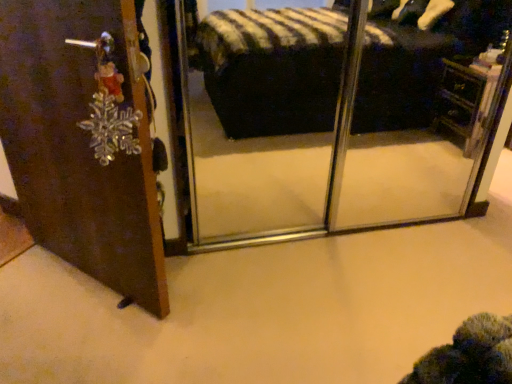
Where is `free space on the front side of brown wooden door at left`? This screenshot has width=512, height=384. free space on the front side of brown wooden door at left is located at coordinates (78, 331).